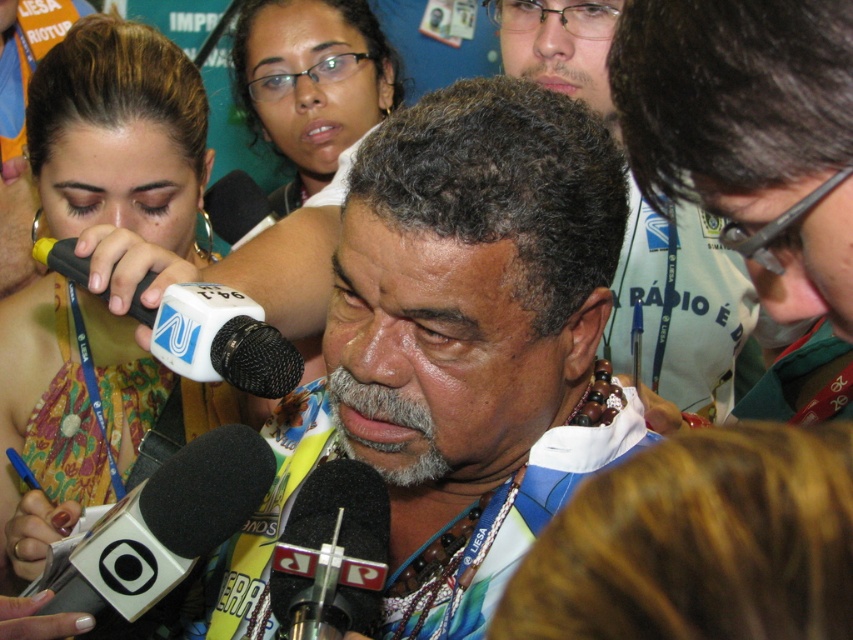
Question: Is multicolored fabric shirt at center further to camera compared to multicolored beaded necklace at center?

Choices:
 (A) yes
 (B) no

Answer: (B)

Question: Does matte black glasses at upper center appear over black foam microphone at center?

Choices:
 (A) yes
 (B) no

Answer: (A)

Question: Does matte black glasses at upper center appear on the right side of black plastic microphone at center?

Choices:
 (A) yes
 (B) no

Answer: (B)

Question: Which of the following is the farthest from the observer?

Choices:
 (A) (61, 90)
 (B) (216, 332)
 (C) (753, 314)
 (D) (238, 486)

Answer: (C)

Question: Which is farther from the black plastic microphone at center?

Choices:
 (A) multicolored beaded necklace at center
 (B) matte yellow dress at center
 (C) matte black glasses at upper center

Answer: (C)

Question: Which object appears closest to the camera in this image?

Choices:
 (A) multicolored beaded necklace at center
 (B) white plastic microphone at center
 (C) black foam microphone at center
 (D) black plastic microphone at center

Answer: (D)